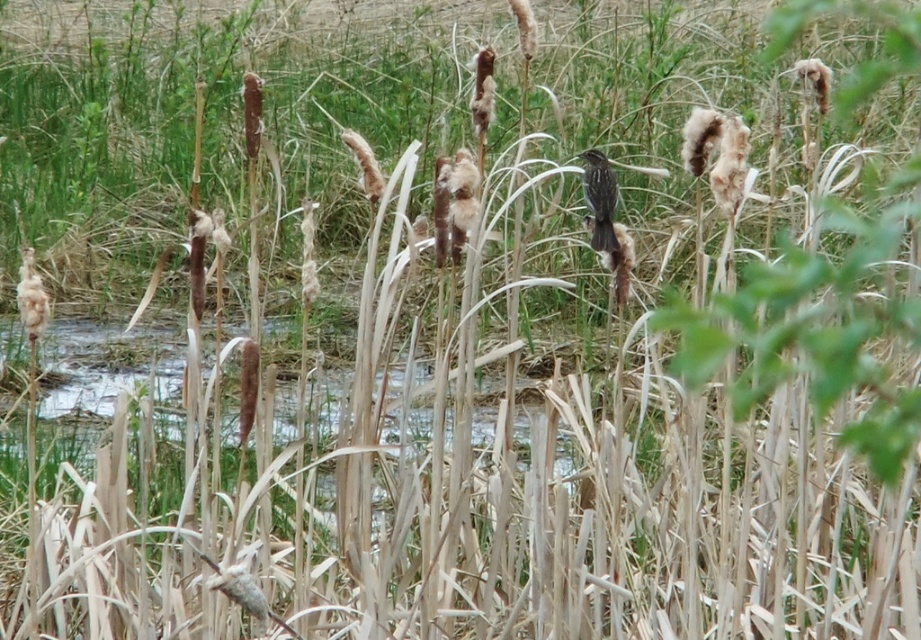
Question: In this image, where is brown speckled bird at center located relative to fuzzy brown reed at left?

Choices:
 (A) below
 (B) above

Answer: (B)

Question: Is brown speckled bird at center to the left of fuzzy brown reed at left from the viewer's perspective?

Choices:
 (A) no
 (B) yes

Answer: (A)

Question: Is brown speckled bird at center bigger than fuzzy brown reed at left?

Choices:
 (A) yes
 (B) no

Answer: (A)

Question: Among these points, which one is farthest from the camera?

Choices:
 (A) (591, 173)
 (B) (21, 301)

Answer: (A)

Question: Which of the following is the closest to the observer?

Choices:
 (A) fuzzy brown reed at left
 (B) brown speckled bird at center

Answer: (A)